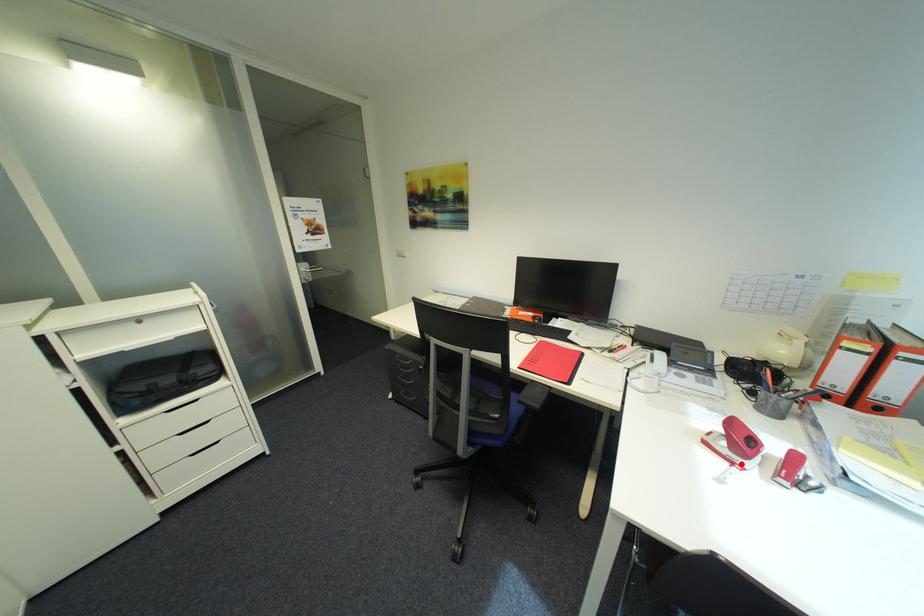
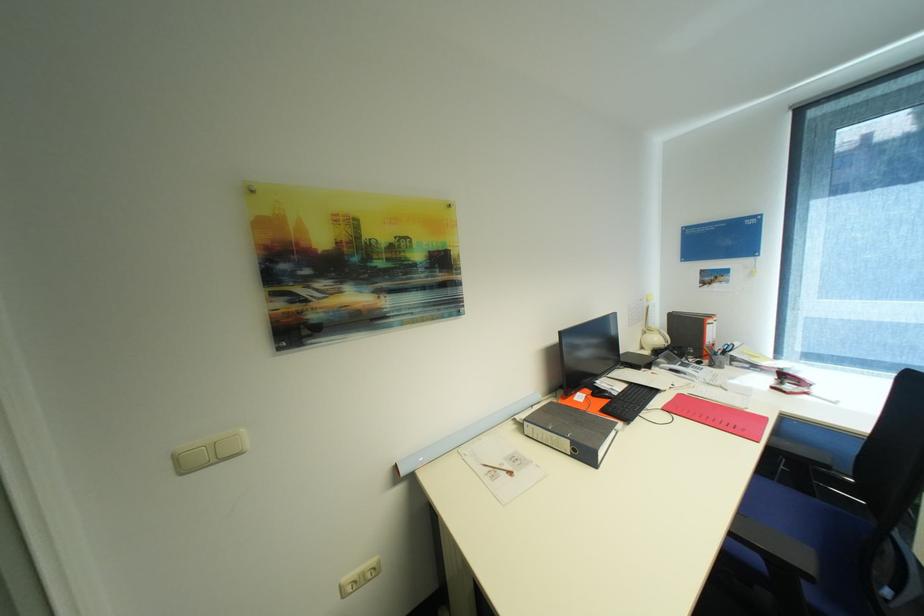
In the second image, find the point that corresponds to the highlighted location in the first image.

(813, 394)